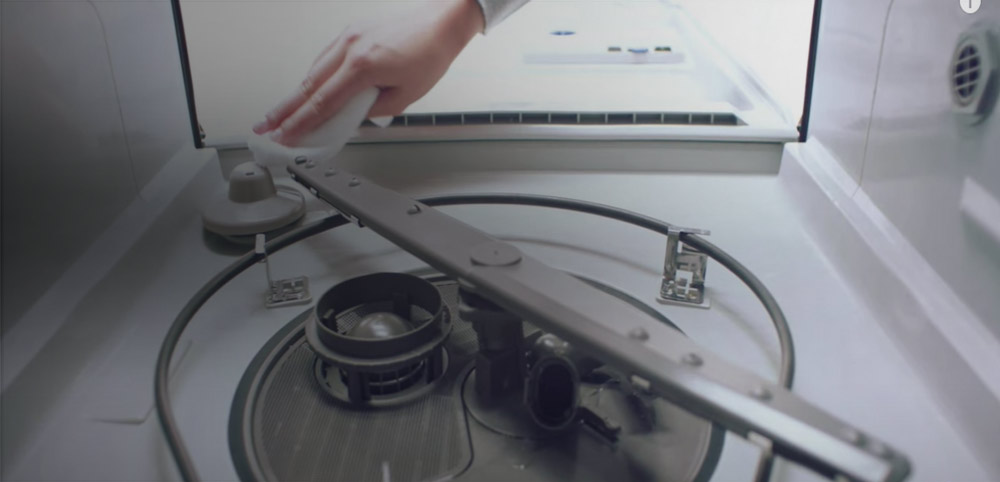
You are a GUI agent. You are given a task and a screenshot of the screen. Output one action in this format:
    pyautogui.click(x=<x>, y=<y>)
    Task: Click on the door of dishwasher
    
    Given the screenshot: What is the action you would take?
    pyautogui.click(x=501, y=78)